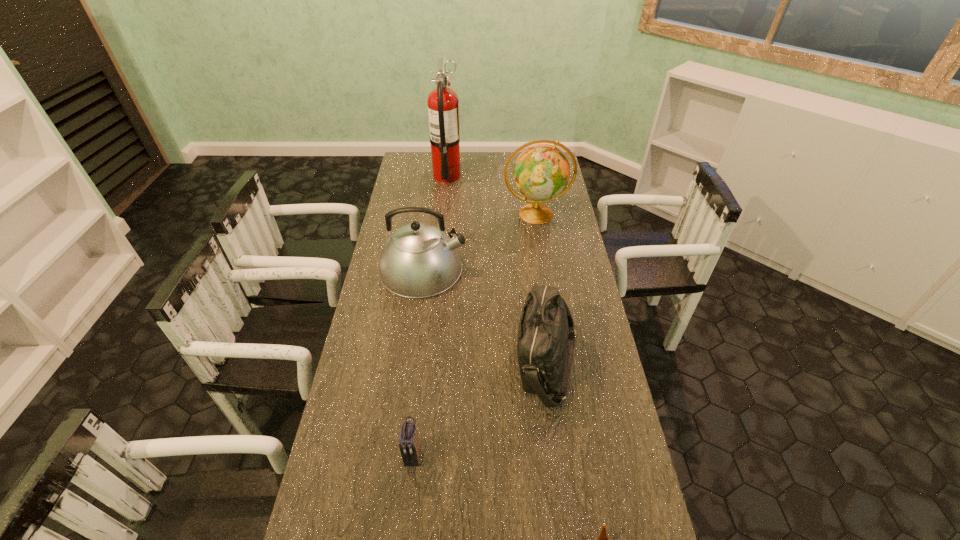
At what (x,y) coordinates should I click in order to perform the action: click on the farthest object. Please return your answer as a coordinate pair (x, y). Looking at the image, I should click on (443, 104).

Where is `fire extinguisher`? fire extinguisher is located at coordinates (443, 104).

You are a GUI agent. You are given a task and a screenshot of the screen. Output one action in this format:
    pyautogui.click(x=<x>, y=<y>)
    Task: Click on the globe
    
    Given the screenshot: What is the action you would take?
    pyautogui.click(x=541, y=172)

In order to click on the fifth shortest object in this screenshot , I will do `click(541, 172)`.

Where is `the third farthest object`? This screenshot has height=540, width=960. the third farthest object is located at coordinates (419, 260).

Find the location of a particular element. The width and height of the screenshot is (960, 540). shoulder bag is located at coordinates (546, 339).

At what (x,y) coordinates should I click in order to perform the action: click on clutch bag. Please return your answer as a coordinate pair (x, y). Looking at the image, I should click on (409, 447).

What are the coordinates of `the second shortest object` in the screenshot? It's located at (409, 447).

Find the location of a particular element. vacant space located on the nozzle side of the farthest object is located at coordinates (498, 176).

Locate an element on the screen. This screenshot has height=540, width=960. free region located 0.380m on the front of the globe is located at coordinates (549, 296).